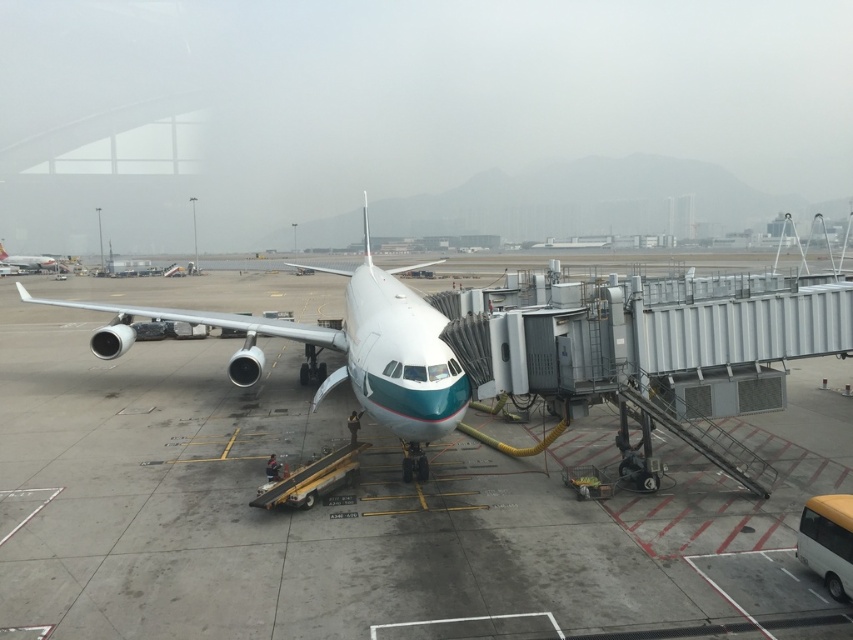
Who is higher up, gray concrete tarmac at center or white glossy airplane at center?

white glossy airplane at center is higher up.

Who is more distant from viewer, (408, 557) or (206, 324)?

Positioned behind is point (206, 324).

The height and width of the screenshot is (640, 853). What do you see at coordinates (347, 492) in the screenshot?
I see `gray concrete tarmac at center` at bounding box center [347, 492].

Locate an element on the screen. gray concrete tarmac at center is located at coordinates (347, 492).

Which is more to the right, gray concrete tarmac at center or white glossy airplane at upper left?

From the viewer's perspective, gray concrete tarmac at center appears more on the right side.

Does gray concrete tarmac at center have a lesser height compared to white glossy airplane at upper left?

Indeed, gray concrete tarmac at center has a lesser height compared to white glossy airplane at upper left.

The height and width of the screenshot is (640, 853). What are the coordinates of `gray concrete tarmac at center` in the screenshot? It's located at (347, 492).

Which is above, white glossy airplane at center or white glossy airplane at upper left?

Positioned higher is white glossy airplane at upper left.

Does white glossy airplane at center appear over white glossy airplane at upper left?

No, white glossy airplane at center is not above white glossy airplane at upper left.

Which is behind, point (323, 333) or point (49, 260)?

Positioned behind is point (49, 260).

This screenshot has height=640, width=853. What are the coordinates of `white glossy airplane at center` in the screenshot? It's located at (338, 348).